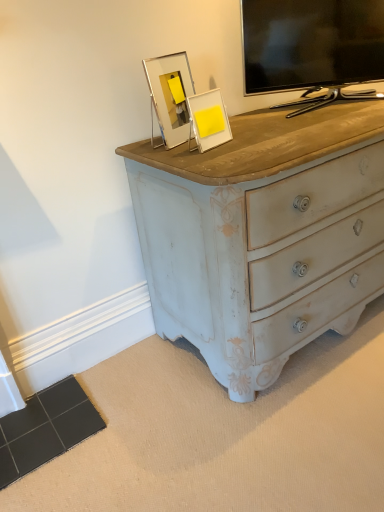
Question: Is yellow matte picture frame at upper center, which ranks as the 1th picture frame in right-to-left order, turned away from black glossy tv at upper right?

Choices:
 (A) no
 (B) yes

Answer: (A)

Question: Considering the relative sizes of yellow matte picture frame at upper center, which is the 2th picture frame in left-to-right order, and black glossy tv at upper right in the image provided, is yellow matte picture frame at upper center, which is the 2th picture frame in left-to-right order, smaller than black glossy tv at upper right?

Choices:
 (A) yes
 (B) no

Answer: (A)

Question: Considering the relative sizes of yellow matte picture frame at upper center, which is the 2th picture frame in left-to-right order, and black glossy tv at upper right in the image provided, is yellow matte picture frame at upper center, which is the 2th picture frame in left-to-right order, shorter than black glossy tv at upper right?

Choices:
 (A) no
 (B) yes

Answer: (B)

Question: From the image's perspective, is yellow matte picture frame at upper center, which is the 2th picture frame in left-to-right order, on top of black glossy tv at upper right?

Choices:
 (A) no
 (B) yes

Answer: (A)

Question: Is yellow matte picture frame at upper center, which is the 2th picture frame in left-to-right order, with black glossy tv at upper right?

Choices:
 (A) yes
 (B) no

Answer: (B)

Question: In the image, is black glossy tv at upper right positioned in front of or behind yellow matte picture frame at upper center, which ranks as the 1th picture frame in right-to-left order?

Choices:
 (A) behind
 (B) front

Answer: (A)

Question: Based on their sizes in the image, would you say black glossy tv at upper right is bigger or smaller than yellow matte picture frame at upper center, which ranks as the 1th picture frame in right-to-left order?

Choices:
 (A) big
 (B) small

Answer: (A)

Question: From their relative heights in the image, would you say black glossy tv at upper right is taller or shorter than yellow matte picture frame at upper center, which ranks as the 1th picture frame in right-to-left order?

Choices:
 (A) tall
 (B) short

Answer: (A)

Question: Is black glossy tv at upper right inside the boundaries of yellow matte picture frame at upper center, which ranks as the 1th picture frame in right-to-left order, or outside?

Choices:
 (A) inside
 (B) outside

Answer: (B)

Question: In the image, is clear acrylic frame at upper center, positioned as the 1th picture frame in left-to-right order, on the left side or the right side of black glossy tv at upper right?

Choices:
 (A) right
 (B) left

Answer: (B)

Question: Would you say clear acrylic frame at upper center, placed as the 2th picture frame when sorted from right to left, is inside or outside black glossy tv at upper right?

Choices:
 (A) outside
 (B) inside

Answer: (A)

Question: Is clear acrylic frame at upper center, placed as the 2th picture frame when sorted from right to left, taller or shorter than black glossy tv at upper right?

Choices:
 (A) short
 (B) tall

Answer: (A)

Question: Considering their positions, is clear acrylic frame at upper center, placed as the 2th picture frame when sorted from right to left, located in front of or behind black glossy tv at upper right?

Choices:
 (A) front
 (B) behind

Answer: (A)

Question: Is clear acrylic frame at upper center, placed as the 2th picture frame when sorted from right to left, taller or shorter than yellow matte picture frame at upper center, which is the 2th picture frame in left-to-right order?

Choices:
 (A) tall
 (B) short

Answer: (A)

Question: Considering the positions of clear acrylic frame at upper center, positioned as the 1th picture frame in left-to-right order, and yellow matte picture frame at upper center, which is the 2th picture frame in left-to-right order, in the image, is clear acrylic frame at upper center, positioned as the 1th picture frame in left-to-right order, bigger or smaller than yellow matte picture frame at upper center, which is the 2th picture frame in left-to-right order,?

Choices:
 (A) big
 (B) small

Answer: (A)